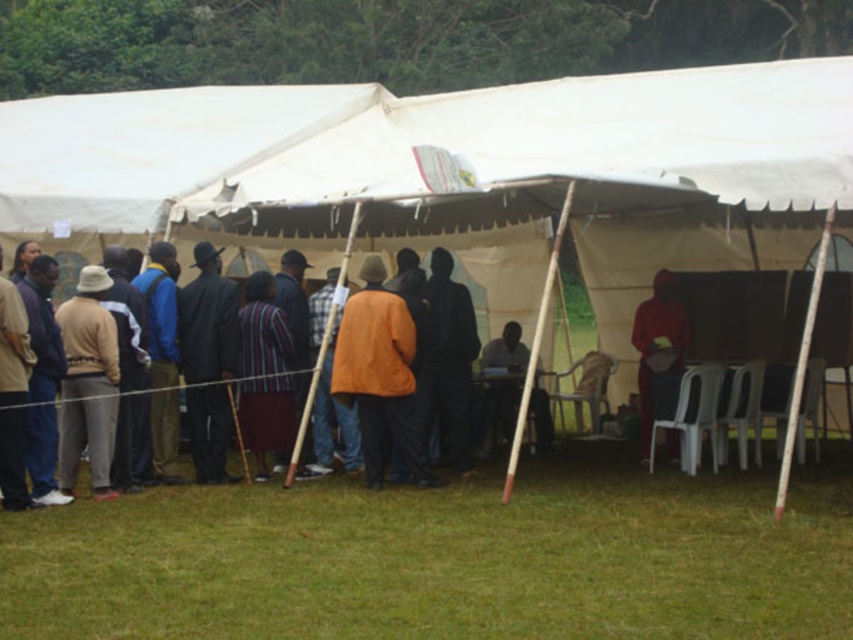
Does point (74, 410) come farther from viewer compared to point (161, 378)?

No.

Who is positioned more to the right, matte beige hat at left or blue fabric jacket at center?

Positioned to the right is blue fabric jacket at center.

Is point (91, 467) farther from viewer compared to point (158, 259)?

No, it is in front of (158, 259).

Locate an element on the screen. matte beige hat at left is located at coordinates (88, 384).

Who is positioned more to the left, blue fabric jacket at center or red matte hoodie at center?

From the viewer's perspective, blue fabric jacket at center appears more on the left side.

Is point (151, 394) in front of point (670, 275)?

That is True.

Is point (166, 424) positioned behind point (650, 392)?

That is False.

Find the location of a particular element. This screenshot has height=640, width=853. blue fabric jacket at center is located at coordinates (161, 356).

Does dark blue fabric coat at center come in front of blue fabric jacket at center?

No.

Does dark blue fabric coat at center have a greater width compared to blue fabric jacket at center?

Yes, dark blue fabric coat at center is wider than blue fabric jacket at center.

Locate an element on the screen. The width and height of the screenshot is (853, 640). dark blue fabric coat at center is located at coordinates (448, 356).